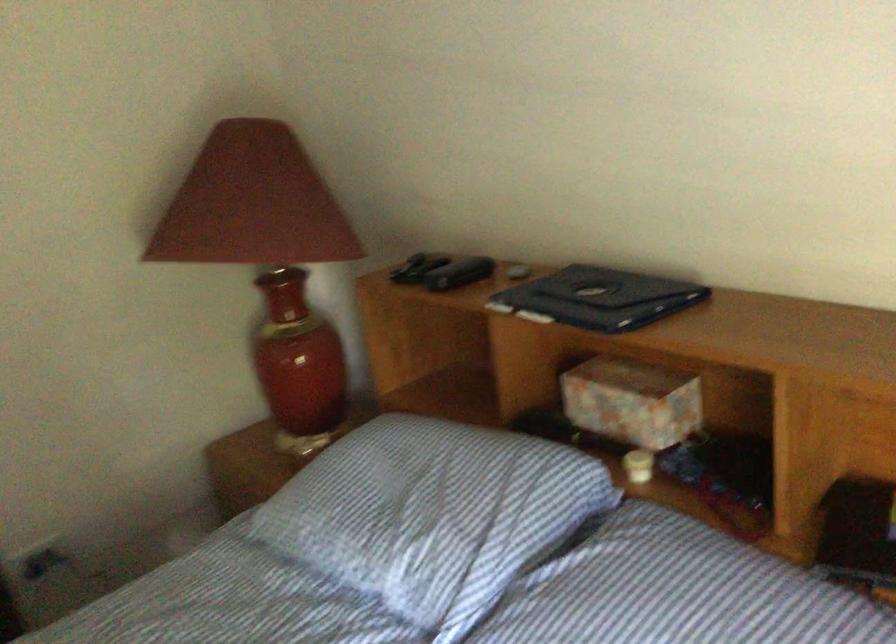
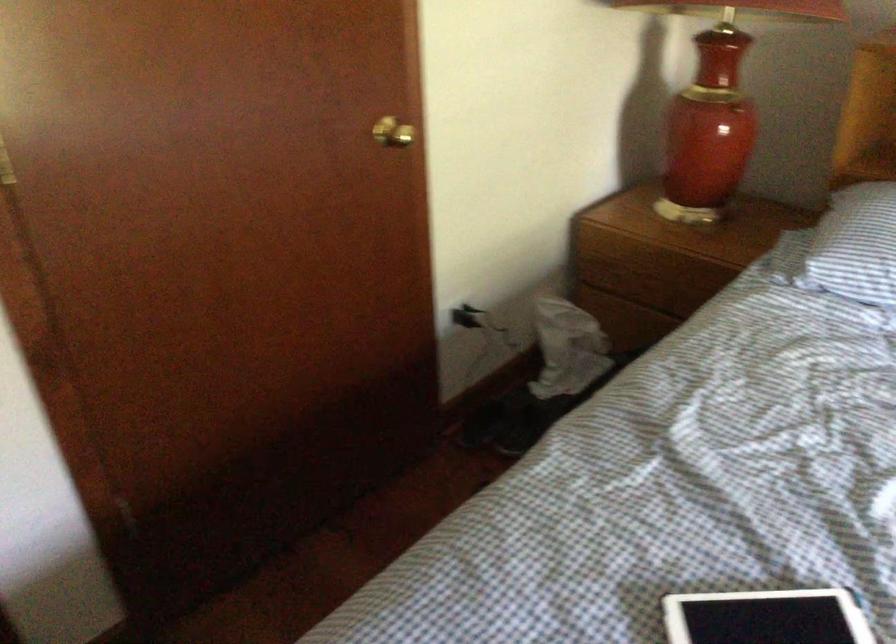
Find the pixel in the second image that matches point 242,502 in the first image.

(650, 283)